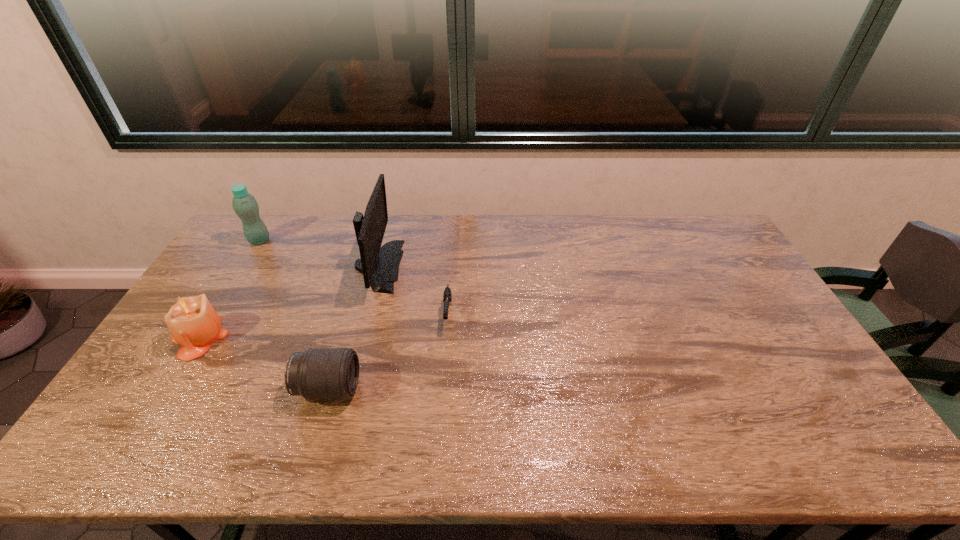
The height and width of the screenshot is (540, 960). In order to click on monitor in this screenshot , I will do `click(379, 265)`.

Locate an element on the screen. This screenshot has height=540, width=960. water bottle is located at coordinates (245, 206).

The width and height of the screenshot is (960, 540). Find the location of `the third shortest object`. the third shortest object is located at coordinates (193, 322).

The height and width of the screenshot is (540, 960). I want to click on the nearest object, so coord(319,373).

Find the location of a particular element. Image resolution: width=960 pixels, height=540 pixels. the second shortest object is located at coordinates click(319, 373).

This screenshot has width=960, height=540. What are the coordinates of `gun` in the screenshot? It's located at (447, 295).

The height and width of the screenshot is (540, 960). I want to click on the rightmost object, so click(x=447, y=295).

The height and width of the screenshot is (540, 960). I want to click on free space located 0.150m on the screen side of the monitor, so click(x=444, y=266).

Locate an element on the screen. The image size is (960, 540). vacant space located at the front cap of the water bottle is located at coordinates (360, 241).

The height and width of the screenshot is (540, 960). I want to click on free space located on the right of the third tallest object, so click(292, 338).